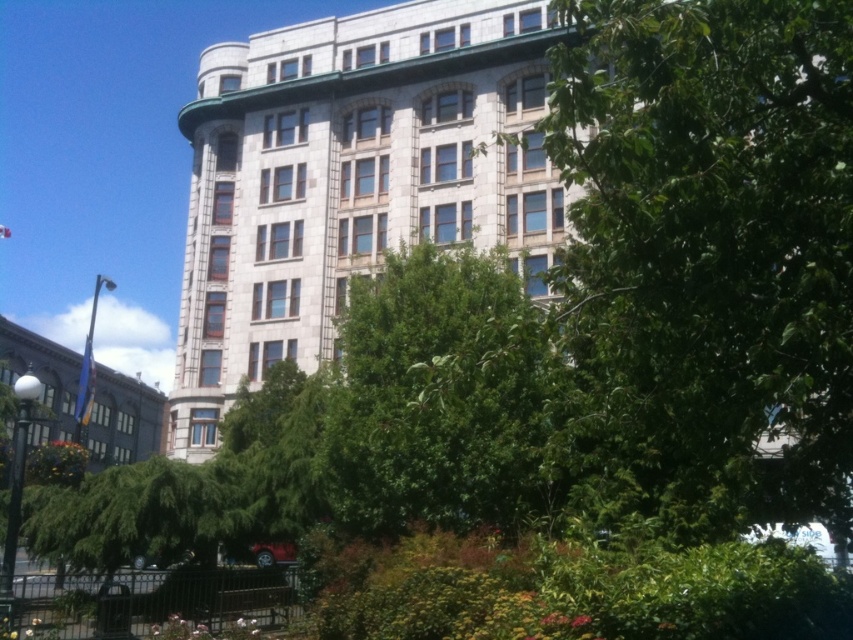
Does stone building at center have a smaller size compared to matte gray building at left?

Indeed, stone building at center has a smaller size compared to matte gray building at left.

Between stone building at center and matte gray building at left, which one is positioned lower?

matte gray building at left is lower down.

This screenshot has height=640, width=853. Describe the element at coordinates (351, 179) in the screenshot. I see `stone building at center` at that location.

Identify the location of stone building at center. The width and height of the screenshot is (853, 640). (351, 179).

Which is more to the right, green leafy tree at center or matte gray building at left?

From the viewer's perspective, green leafy tree at center appears more on the right side.

Where is `green leafy tree at center`? green leafy tree at center is located at coordinates (440, 397).

Locate an element on the screen. green leafy tree at center is located at coordinates (440, 397).

How much distance is there between green leafy tree at upper center and matte gray building at left?

green leafy tree at upper center is 58.88 meters from matte gray building at left.

Which is behind, point (590, 436) or point (10, 339)?

Point (10, 339)

Identify the location of green leafy tree at upper center. (709, 256).

The width and height of the screenshot is (853, 640). In order to click on green leafy tree at upper center in this screenshot , I will do `click(709, 256)`.